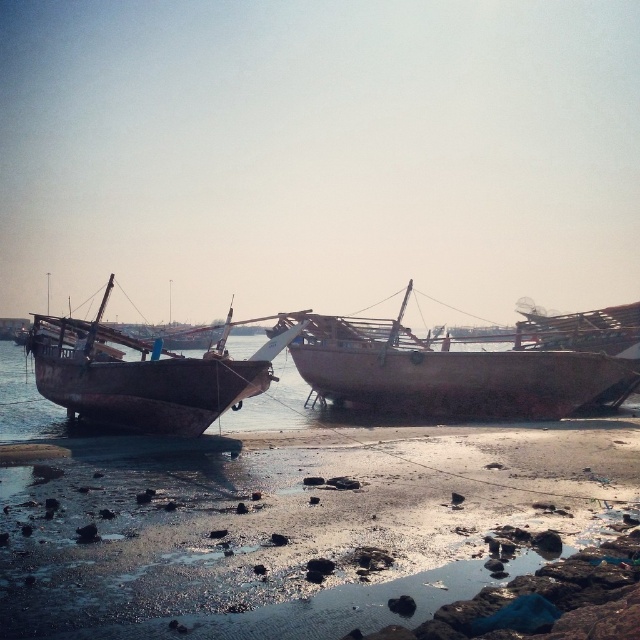
Question: Among these points, which one is nearest to the camera?

Choices:
 (A) (380, 412)
 (B) (168, 392)

Answer: (B)

Question: Is rusty wood boat at center below rusty wooden boat at left?

Choices:
 (A) yes
 (B) no

Answer: (A)

Question: Does rusty wood boat at center have a smaller size compared to rusty wooden boat at left?

Choices:
 (A) no
 (B) yes

Answer: (A)

Question: Which point is closer to the camera taking this photo?

Choices:
 (A) (316, 355)
 (B) (132, 346)

Answer: (B)

Question: Is rusty wood boat at center smaller than rusty wooden boat at left?

Choices:
 (A) yes
 (B) no

Answer: (B)